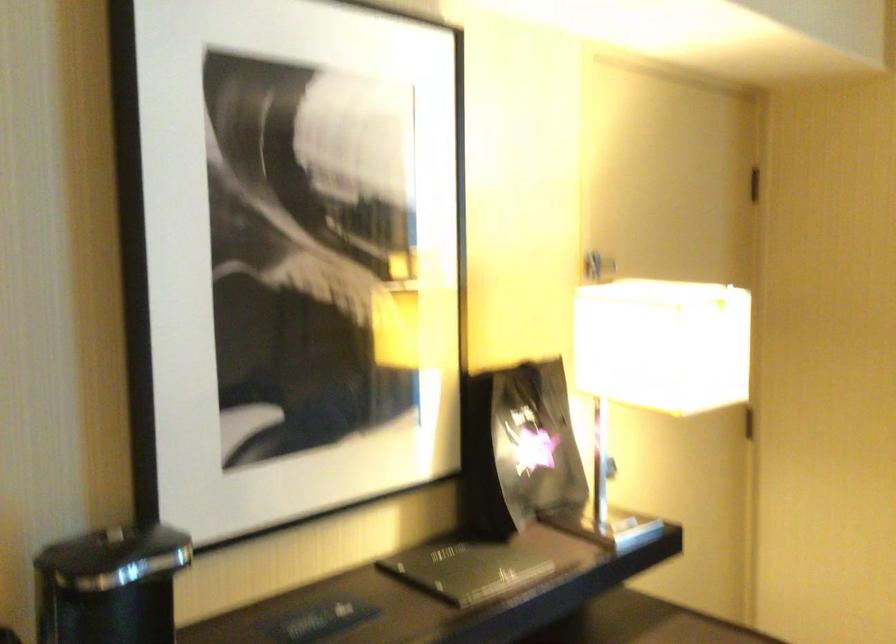
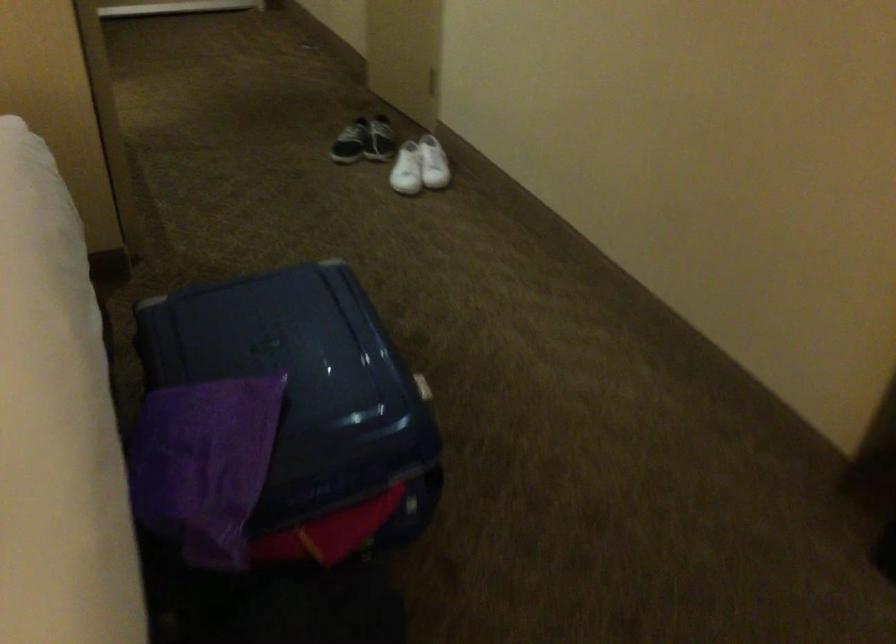
Based on the continuous images, in which direction is the camera rotating?

The camera rotated toward left-down.